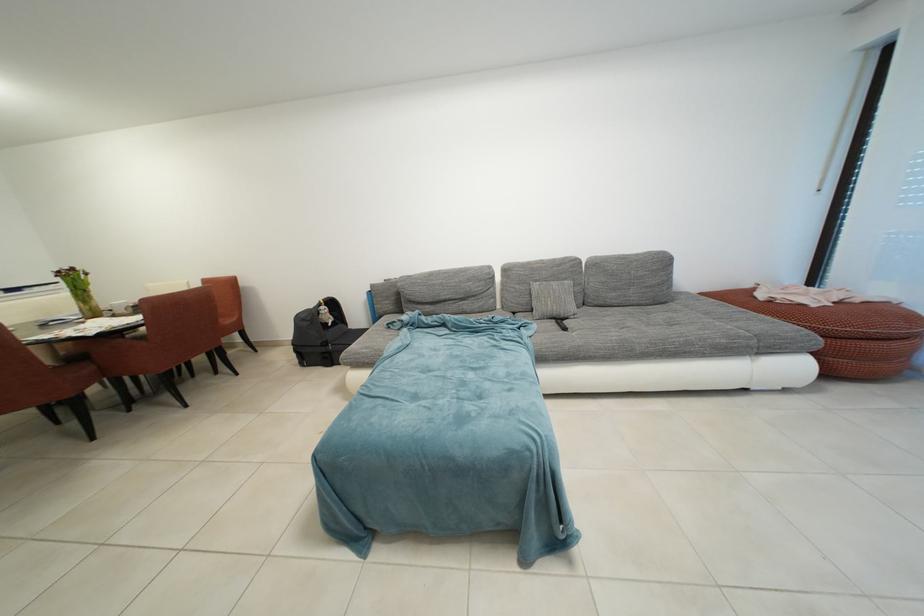
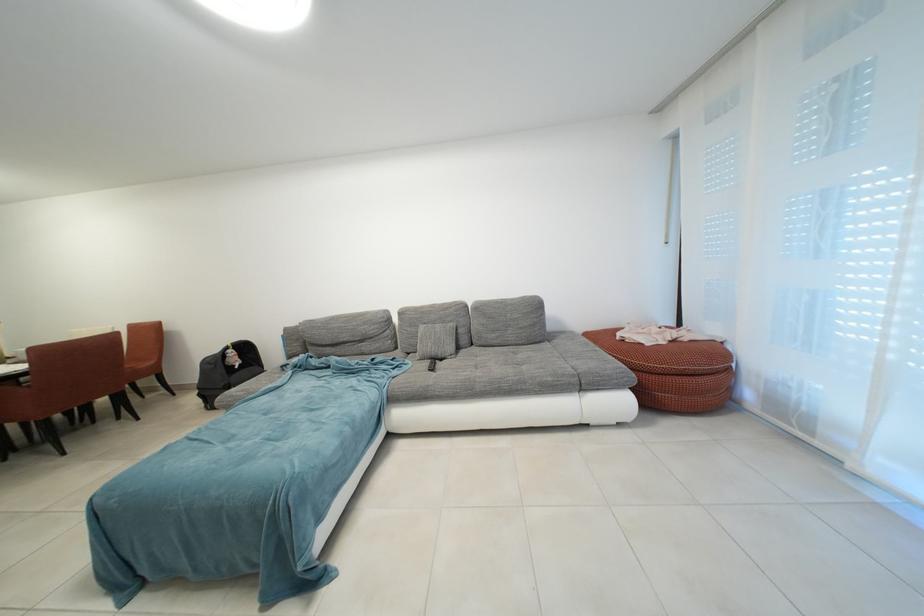
Question: In a continuous first-person perspective shot, in which direction is the camera moving?

Choices:
 (A) Left
 (B) Right
 (C) Forward
 (D) Backward

Answer: (B)